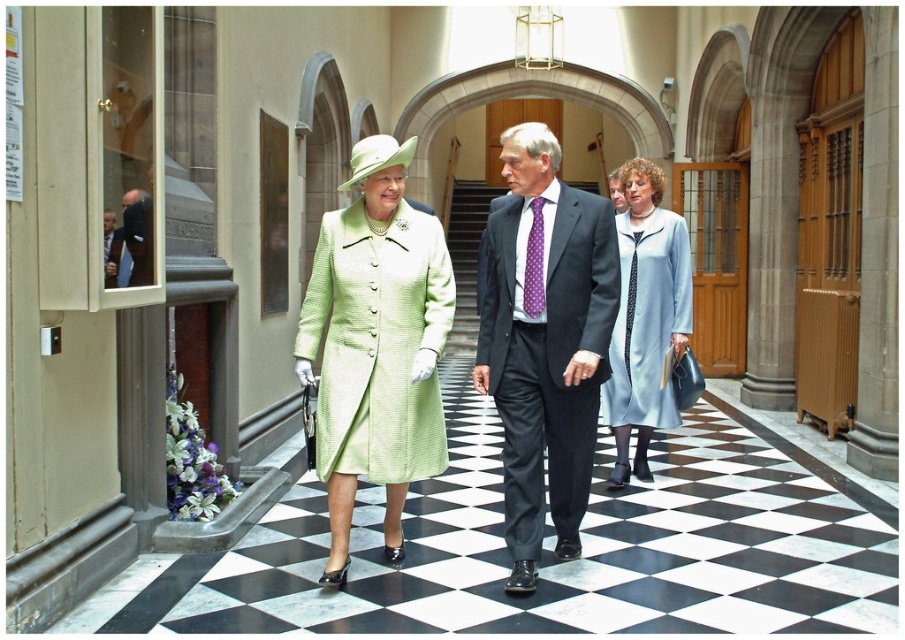
Question: Which point is farther to the camera?

Choices:
 (A) (433, 224)
 (B) (541, 500)

Answer: (A)

Question: Which point is closer to the camera taking this photo?

Choices:
 (A) (512, 355)
 (B) (129, 276)
 (C) (659, 172)
 (D) (338, 368)

Answer: (B)

Question: Is lime green textured coat at center positioned behind light blue fabric dress at center?

Choices:
 (A) no
 (B) yes

Answer: (A)

Question: Which point is closer to the camera?

Choices:
 (A) dark blue suit at left
 (B) dark gray suit at center

Answer: (A)

Question: Does linen green coat at center have a greater width compared to dark blue suit at left?

Choices:
 (A) no
 (B) yes

Answer: (B)

Question: Is light blue fabric dress at center thinner than dark blue suit at left?

Choices:
 (A) yes
 (B) no

Answer: (B)